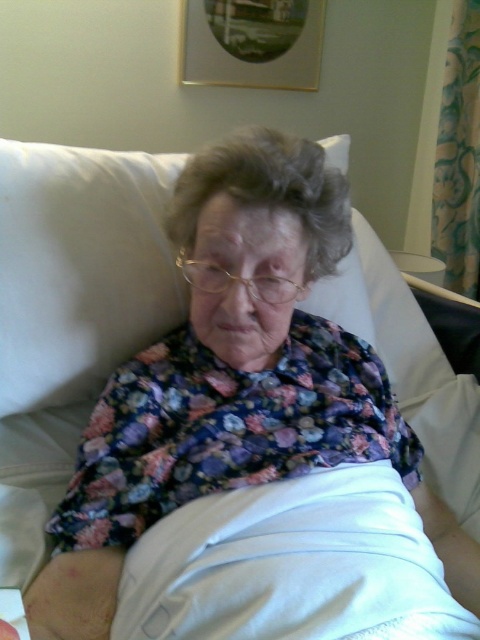
Which is more to the right, white fabric at center or white fabric pillow at upper center?

Positioned to the right is white fabric at center.

Who is taller, white fabric at center or white fabric pillow at upper center?

With more height is white fabric pillow at upper center.

Which is in front, point (392, 472) or point (349, 278)?

Point (392, 472) is in front.

Locate an element on the screen. white fabric at center is located at coordinates (291, 564).